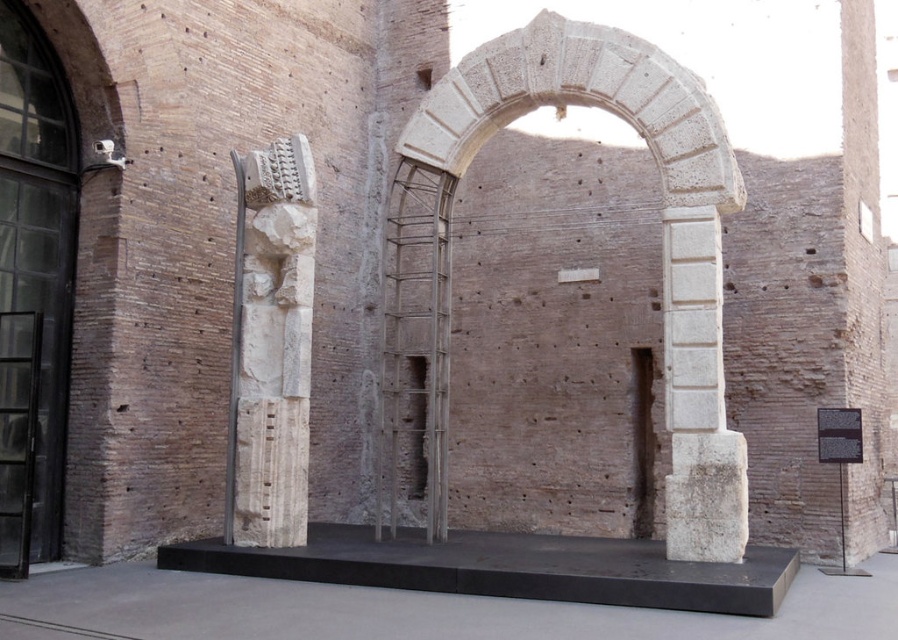
How much distance is there between white stone archway at center and white marble statue at center?

white stone archway at center and white marble statue at center are 9.42 meters apart from each other.

Does white stone archway at center have a larger size compared to white marble statue at center?

Yes, white stone archway at center is bigger than white marble statue at center.

The width and height of the screenshot is (898, 640). I want to click on white stone archway at center, so click(x=662, y=227).

Can you confirm if white stone archway at center is positioned to the right of white stone column at center?

Incorrect, white stone archway at center is not on the right side of white stone column at center.

Does white stone archway at center appear over white stone column at center?

Indeed, white stone archway at center is positioned over white stone column at center.

Find the location of a particular element. white stone archway at center is located at coordinates (662, 227).

Can you confirm if white marble statue at center is positioned below white stone column at center?

Actually, white marble statue at center is above white stone column at center.

Is white marble statue at center further to camera compared to white stone column at center?

Yes, white marble statue at center is behind white stone column at center.

What do you see at coordinates (271, 346) in the screenshot?
I see `white marble statue at center` at bounding box center [271, 346].

The image size is (898, 640). I want to click on white marble statue at center, so (x=271, y=346).